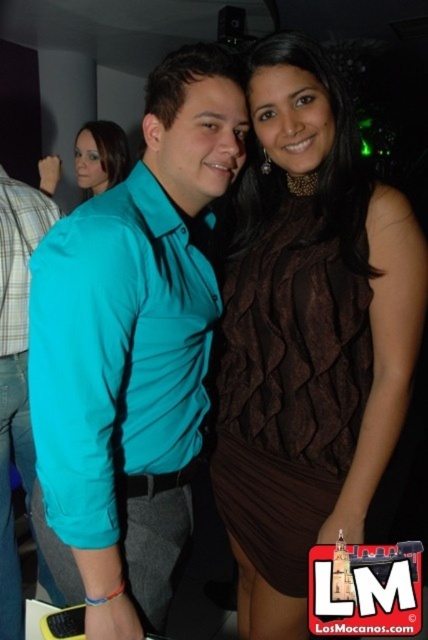
Question: From the image, what is the correct spatial relationship of teal shirt at center in relation to matte teal shirt at center?

Choices:
 (A) right
 (B) left

Answer: (A)

Question: Estimate the real-world distances between objects in this image. Which object is closer to the matte teal blouse at upper left?

Choices:
 (A) teal shirt at center
 (B) matte teal shirt at center
 (C) brown textured dress at center

Answer: (B)

Question: Considering the real-world distances, which object is farthest from the brown textured dress at center?

Choices:
 (A) matte teal shirt at center
 (B) teal shirt at center
 (C) matte teal blouse at upper left

Answer: (C)

Question: Where is brown textured dress at center located in relation to matte teal shirt at center in the image?

Choices:
 (A) left
 (B) right

Answer: (B)

Question: Which point is farther to the camera?

Choices:
 (A) (50, 284)
 (B) (287, 525)

Answer: (B)

Question: Is matte teal shirt at center smaller than matte teal blouse at upper left?

Choices:
 (A) no
 (B) yes

Answer: (A)